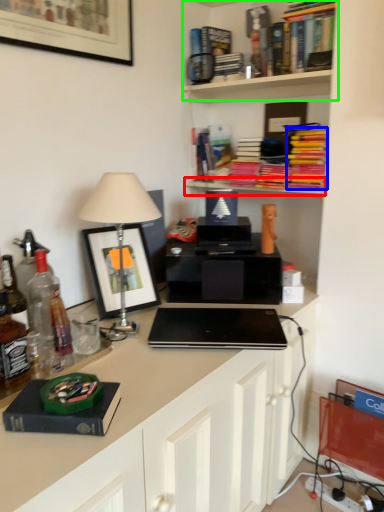
Question: Which object is the closest to the shelf (highlighted by a red box)? Choose among these: book (highlighted by a blue box) or shelf (highlighted by a green box).

Choices:
 (A) book
 (B) shelf

Answer: (A)